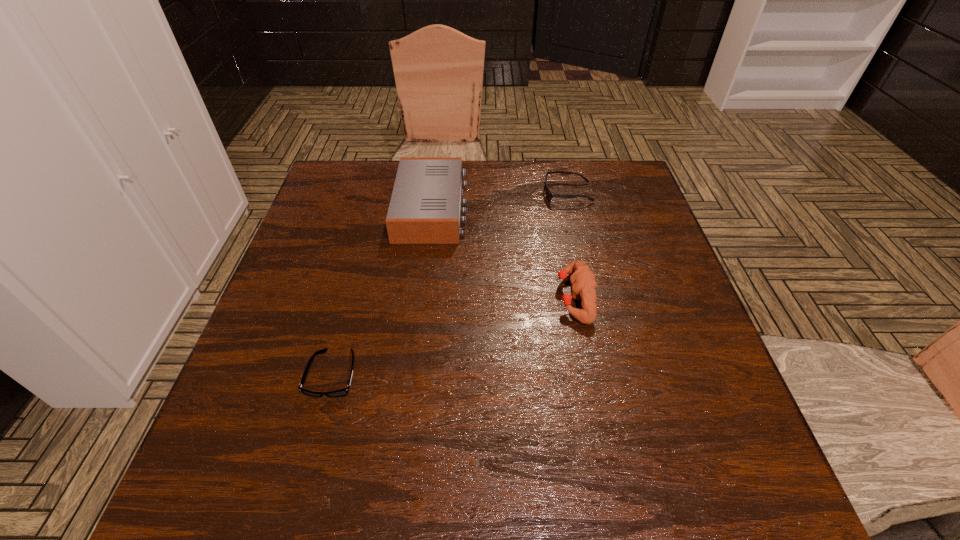
The height and width of the screenshot is (540, 960). In the image, there is a desktop. Identify the location of vacant space at the near edge. (607, 504).

Find the location of `vacant space at the left edge of the desktop`. vacant space at the left edge of the desktop is located at coordinates (271, 377).

This screenshot has width=960, height=540. Find the location of `vacant space at the right edge of the desktop`. vacant space at the right edge of the desktop is located at coordinates (733, 427).

Find the location of a particular element. The width and height of the screenshot is (960, 540). vacant space at the far left corner of the desktop is located at coordinates (365, 199).

Identify the location of vacant space at the near left corner. The width and height of the screenshot is (960, 540). (225, 505).

Identify the location of free spot at the near right corner of the desktop. (668, 476).

I want to click on unoccupied position between the second nearest object and the radio receiver, so click(x=503, y=253).

I want to click on vacant area that lies between the radio receiver and the farther sunglasses, so tap(500, 200).

Locate an element on the screen. Image resolution: width=960 pixels, height=540 pixels. blank region between the puncher and the shortest object is located at coordinates (454, 335).

You are a GUI agent. You are given a task and a screenshot of the screen. Output one action in this format:
    pyautogui.click(x=<x>, y=<y>)
    Task: Click on the vacant space that's between the third object from right to left and the right sunglasses
    Image resolution: width=960 pixels, height=540 pixels.
    Given the screenshot: What is the action you would take?
    pyautogui.click(x=500, y=200)